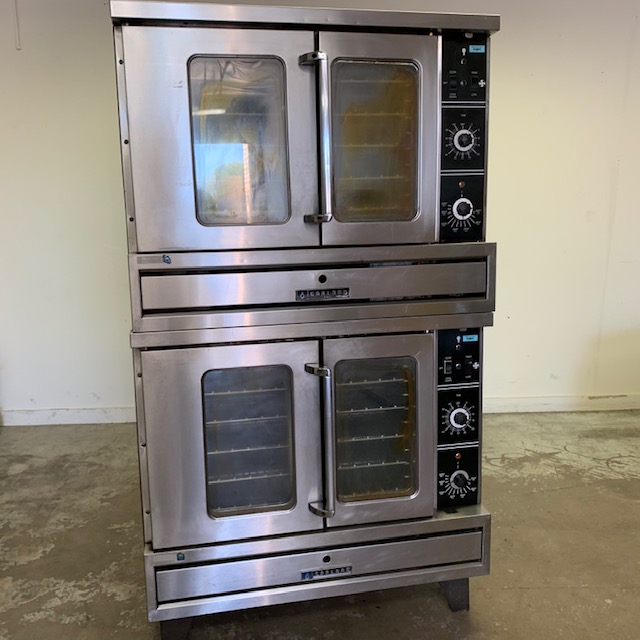
Find the location of `door handles`. door handles is located at coordinates [x=329, y=441], [x=326, y=138].